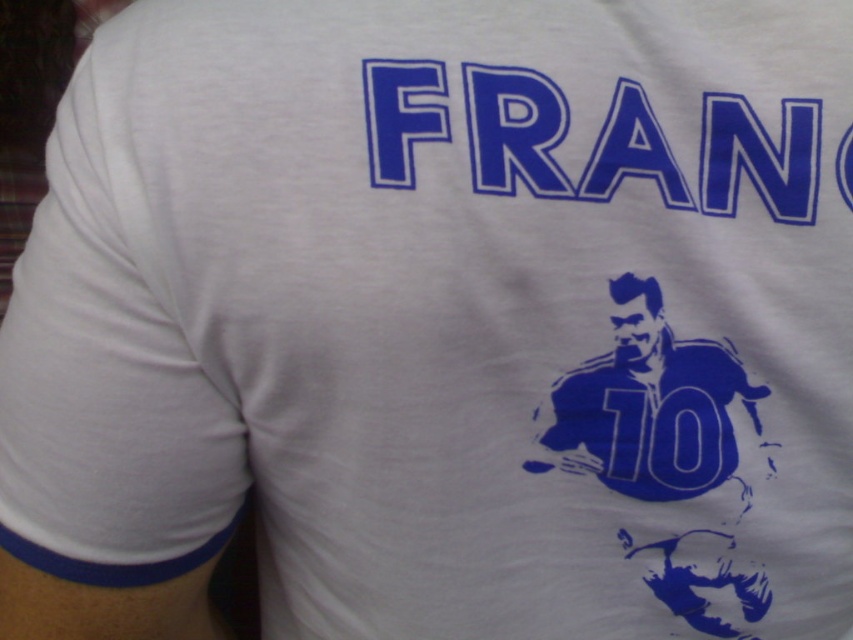
Is blue fabric text at upper center smaller than blue matte/ink soccer player at center?

No.

Does blue fabric text at upper center have a greater width compared to blue matte/ink soccer player at center?

Yes.

Which is behind, point (430, 80) or point (689, 406)?

The point (689, 406) is more distant.

This screenshot has width=853, height=640. Find the location of `blue fabric text at upper center`. blue fabric text at upper center is located at coordinates (639, 147).